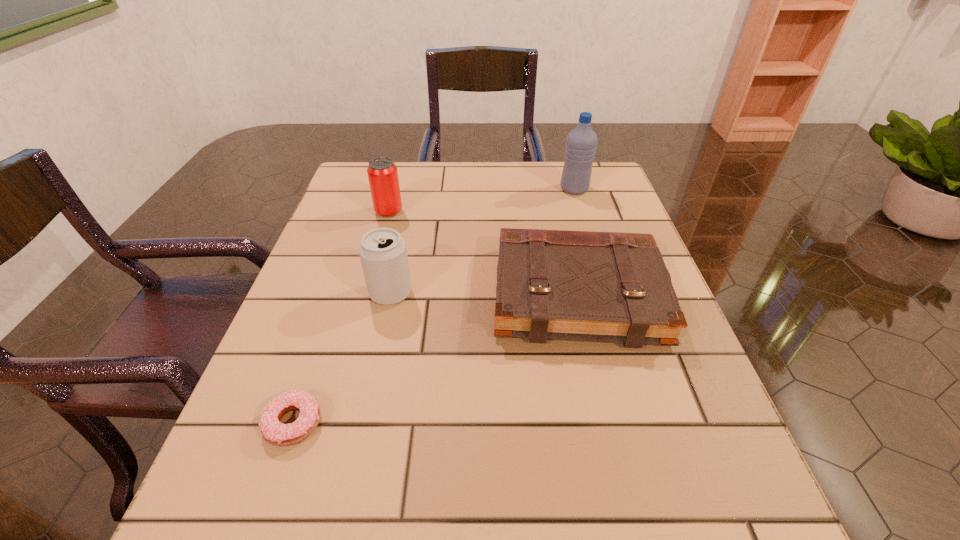
Identify the location of vacant region at the near edge of the desktop. This screenshot has width=960, height=540. (418, 511).

You are a GUI agent. You are given a task and a screenshot of the screen. Output one action in this format:
    pyautogui.click(x=<x>, y=<y>)
    Task: Click on the vacant position at the left edge of the desktop
    The width and height of the screenshot is (960, 540).
    Given the screenshot: What is the action you would take?
    pyautogui.click(x=366, y=309)

At what (x,y) coordinates should I click in order to perform the action: click on free space at the right edge of the desktop. Please return your answer as a coordinate pair (x, y). Looking at the image, I should click on (708, 424).

What are the coordinates of `vacant space that is in between the doughnut and the fourth tallest object` in the screenshot? It's located at (435, 359).

I want to click on free space between the doughnut and the farther can, so click(x=341, y=318).

You are a GUI agent. You are given a task and a screenshot of the screen. Output one action in this format:
    pyautogui.click(x=<x>, y=<y>)
    Task: Click on the vacant area that lies between the water bottle and the nearest object
    
    Given the screenshot: What is the action you would take?
    pyautogui.click(x=434, y=306)

This screenshot has width=960, height=540. I want to click on free space between the doughnut and the second shortest object, so click(x=435, y=359).

Identify the location of free point between the doughnut and the farther can. (341, 318).

This screenshot has width=960, height=540. Find the location of `unoccupied area between the tallest object and the second farthest object`. unoccupied area between the tallest object and the second farthest object is located at coordinates (482, 200).

Find the location of a particular element. This screenshot has width=960, height=540. vacant point located between the shortest object and the farthest object is located at coordinates (434, 306).